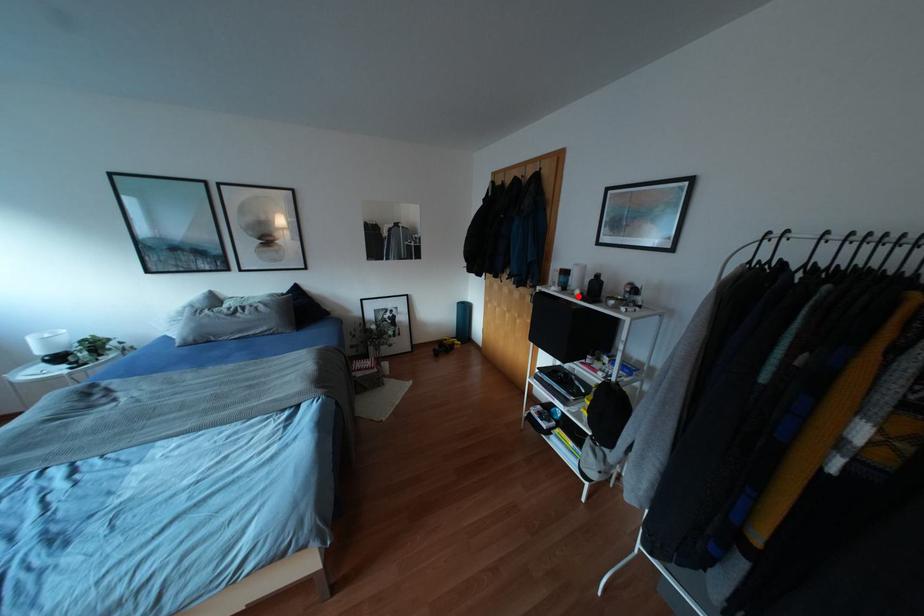
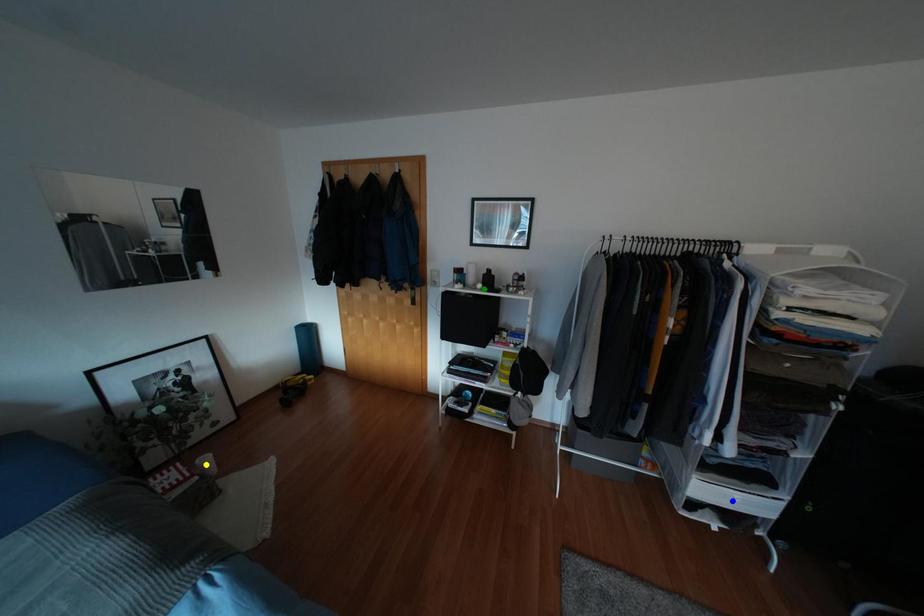
Question: I am providing you with two images of the same scene from different viewpoints. A red point is marked on the first image. You are given multiple points on the second image. Which spot in image 2 lines up with the point in image 1?

Choices:
 (A) green point
 (B) blue point
 (C) yellow point

Answer: (A)